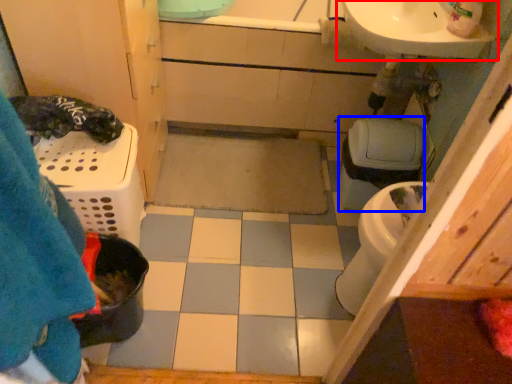
Question: Which object is further to the camera taking this photo, sink (highlighted by a red box) or toilet bowl (highlighted by a blue box)?

Choices:
 (A) sink
 (B) toilet bowl

Answer: (B)